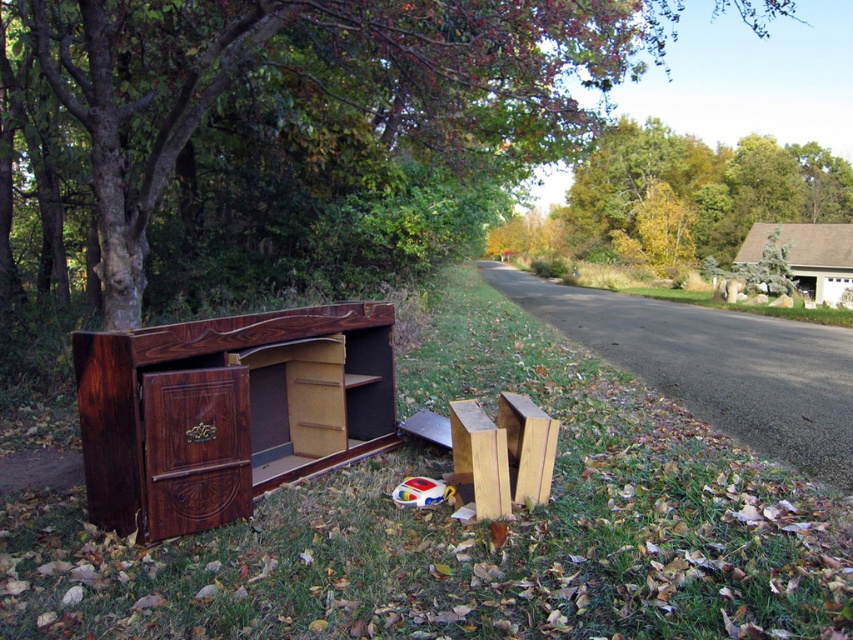
Question: Considering the real-world distances, which object is closest to the wooden drawer at center?

Choices:
 (A) brown grass at lower left
 (B) brown wood tree at left
 (C) wooden blocks at lower center
 (D) dark wood cabinet at left

Answer: (D)

Question: Is brown grass at lower left above wooden drawer at center?

Choices:
 (A) no
 (B) yes

Answer: (A)

Question: Based on their relative distances, which object is farther from the wooden blocks at lower center?

Choices:
 (A) brown wood tree at left
 (B) wooden drawer at center
 (C) brown grass at lower left
 (D) dark wood cabinet at left

Answer: (A)

Question: Is wooden drawer at center smaller than wooden blocks at lower center?

Choices:
 (A) no
 (B) yes

Answer: (B)

Question: Which object is farther from the camera taking this photo?

Choices:
 (A) brown wood tree at left
 (B) brown grass at lower left
 (C) wooden drawer at center
 (D) dark wood cabinet at left

Answer: (A)

Question: Where is brown wood tree at left located in relation to wooden drawer at center in the image?

Choices:
 (A) left
 (B) right

Answer: (B)